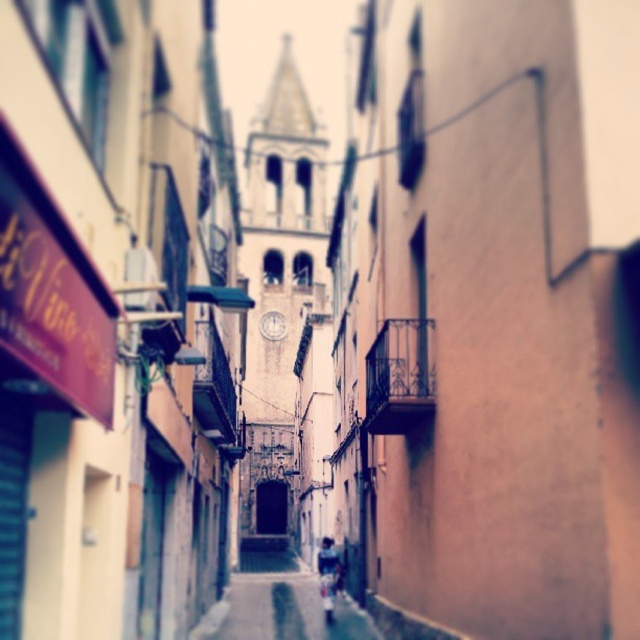
Can you confirm if smooth concrete alley at center is thinner than dark blue denim jacket at center?

Incorrect, smooth concrete alley at center's width is not less than dark blue denim jacket at center's.

Find the location of a particular element. smooth concrete alley at center is located at coordinates (280, 604).

Find the location of `smooth concrete alley at center`. smooth concrete alley at center is located at coordinates 280,604.